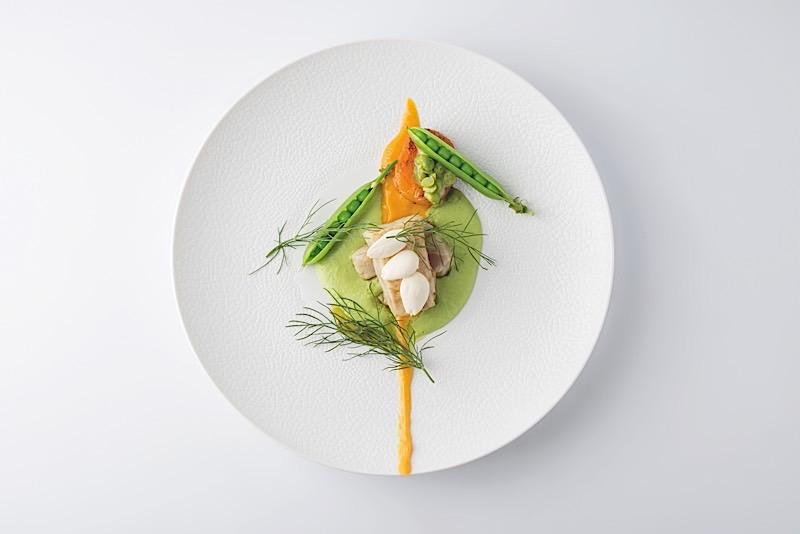
Identify the location of table. (706, 285).